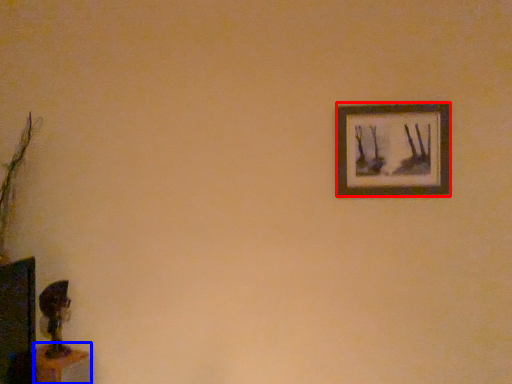
Question: Which object is further to the camera taking this photo, picture frame (highlighted by a red box) or table (highlighted by a blue box)?

Choices:
 (A) picture frame
 (B) table

Answer: (A)